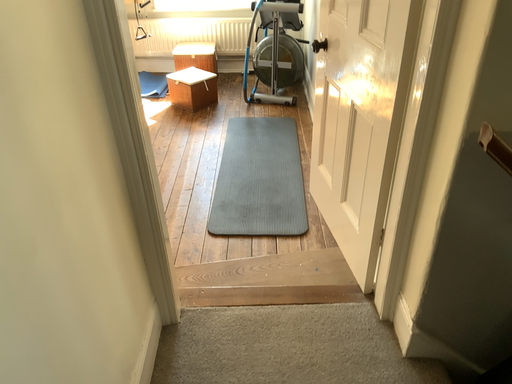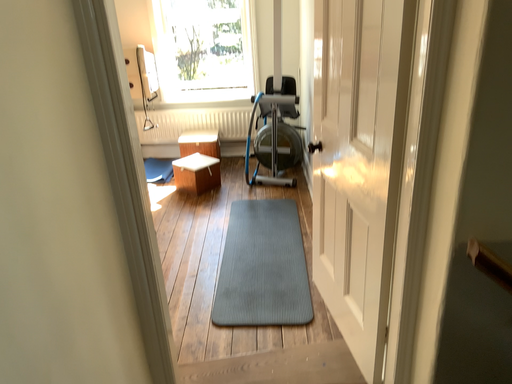
Question: Which way did the camera rotate in the video?

Choices:
 (A) rotated upward
 (B) rotated downward

Answer: (A)